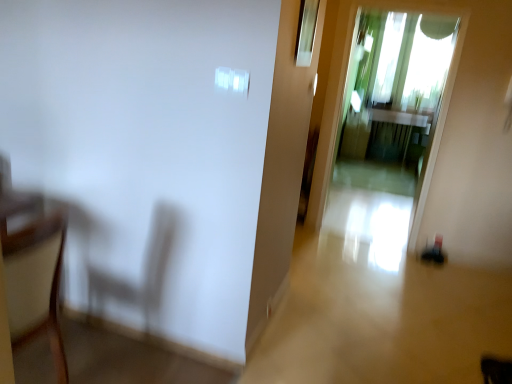
Question: Visually, is transparent glass window at upper center positioned to the left or to the right of wooden armchair at left?

Choices:
 (A) left
 (B) right

Answer: (B)

Question: From the image's perspective, relative to wooden armchair at left, is transparent glass window at upper center above or below?

Choices:
 (A) below
 (B) above

Answer: (B)

Question: Considering the real-world distances, which object is closest to the transparent glass screen door at center?

Choices:
 (A) transparent glass window at upper center
 (B) wooden armchair at left

Answer: (A)

Question: Which object is the farthest from the wooden armchair at left?

Choices:
 (A) transparent glass window at upper center
 (B) transparent glass screen door at center

Answer: (B)